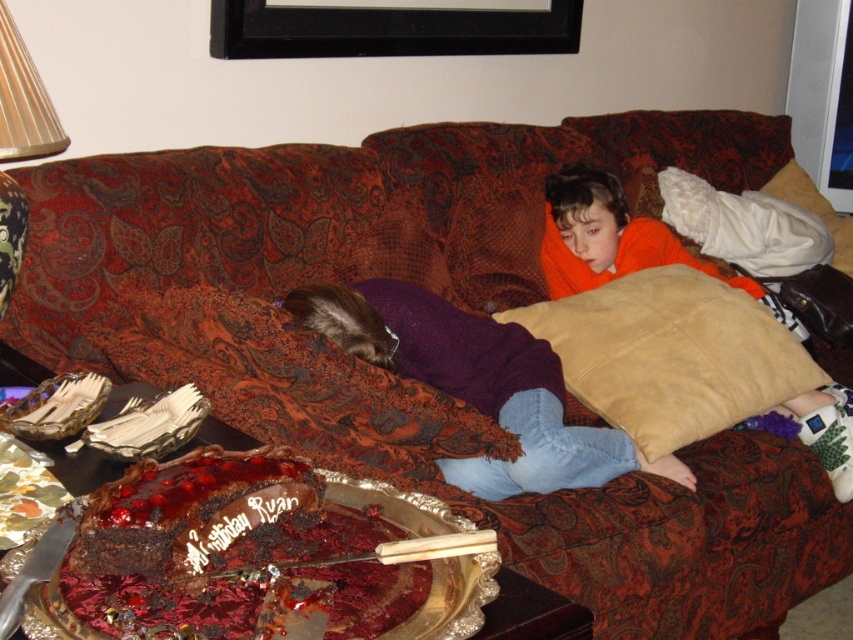
Does suede beige pillow at center have a lesser width compared to purple sweater at center?

Yes, suede beige pillow at center is thinner than purple sweater at center.

What do you see at coordinates (671, 355) in the screenshot?
I see `suede beige pillow at center` at bounding box center [671, 355].

At what (x,y) coordinates should I click in order to perform the action: click on suede beige pillow at center. Please return your answer as a coordinate pair (x, y). Looking at the image, I should click on (671, 355).

Is the position of purple sweater at center more distant than that of black wood picture frame at upper center?

No, it is not.

From the picture: Is purple sweater at center above black wood picture frame at upper center?

No.

The image size is (853, 640). What are the coordinates of `purple sweater at center` in the screenshot? It's located at (477, 384).

Can you confirm if black wood picture frame at upper center is taller than wooden lampshade at upper left?

Yes, black wood picture frame at upper center is taller than wooden lampshade at upper left.

Can you confirm if black wood picture frame at upper center is positioned above wooden lampshade at upper left?

Indeed, black wood picture frame at upper center is positioned over wooden lampshade at upper left.

Does point (236, 28) lie in front of point (16, 80)?

That is False.

The image size is (853, 640). What are the coordinates of `black wood picture frame at upper center` in the screenshot? It's located at (387, 29).